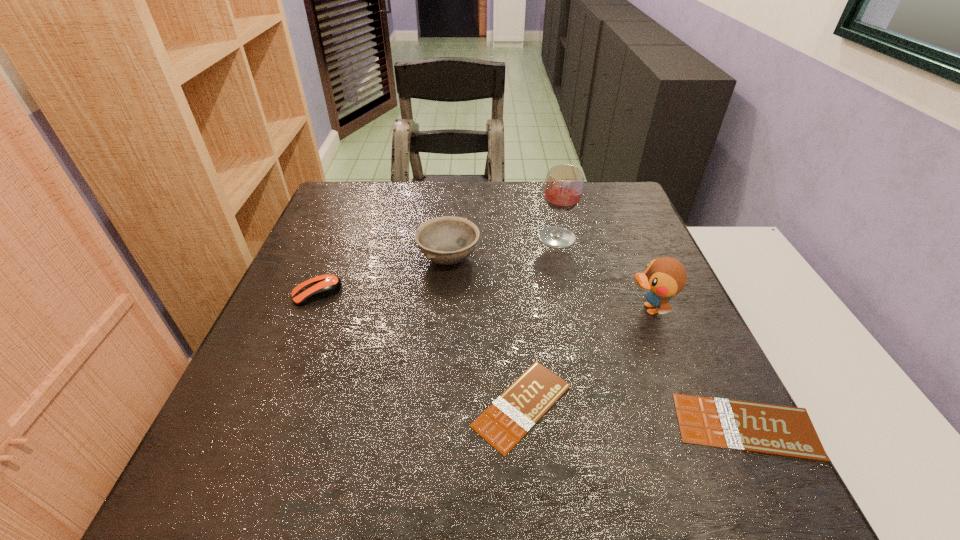
Find the location of a particular element. This screenshot has height=540, width=960. the shorter chocolate bar is located at coordinates (503, 424).

Where is `the left chocolate bar`? the left chocolate bar is located at coordinates (503, 424).

The height and width of the screenshot is (540, 960). What are the coordinates of `the taller chocolate bar` in the screenshot? It's located at (786, 431).

Locate an element on the screen. This screenshot has height=540, width=960. the right chocolate bar is located at coordinates (786, 431).

You are a GUI agent. You are given a task and a screenshot of the screen. Output one action in this format:
    pyautogui.click(x=<x>, y=<y>)
    Task: Click on the tallest object
    The image size is (960, 540).
    Given the screenshot: What is the action you would take?
    pyautogui.click(x=563, y=189)

The width and height of the screenshot is (960, 540). What are the coordinates of `the fourth tallest object` in the screenshot? It's located at (323, 286).

Locate an element on the screen. computer mouse is located at coordinates (323, 286).

The height and width of the screenshot is (540, 960). I want to click on the fourth shortest object, so click(447, 240).

At what (x,y) coordinates should I click in order to perform the action: click on duck. Please return your answer as a coordinate pair (x, y). Looking at the image, I should click on [664, 277].

At what (x,y) coordinates should I click in order to perform the action: click on blank area located on the right of the shorter chocolate bar. Please return your answer as a coordinate pair (x, y). The image size is (960, 540). Looking at the image, I should click on (686, 405).